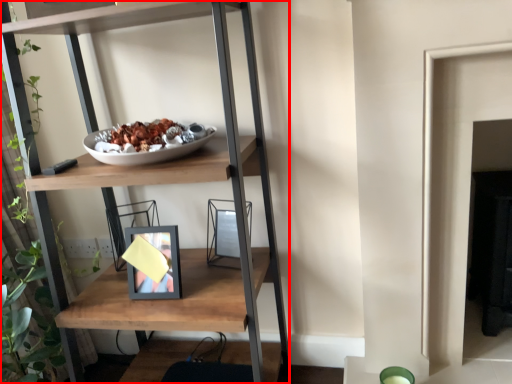
Question: Where is shelf (annotated by the red box) located in relation to picture frame in the image?

Choices:
 (A) right
 (B) left

Answer: (B)